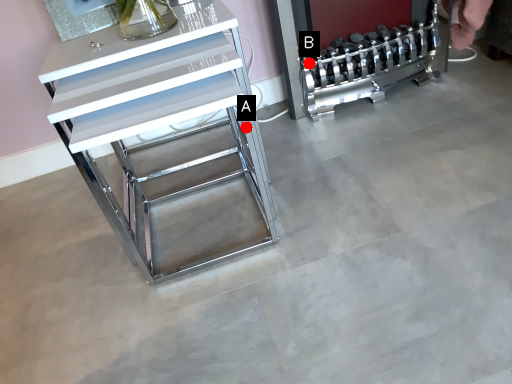
Question: Two points are circled on the image, labeled by A and B beside each circle. Which of the following is the closest to the observer?

Choices:
 (A) A is closer
 (B) B is closer

Answer: (B)